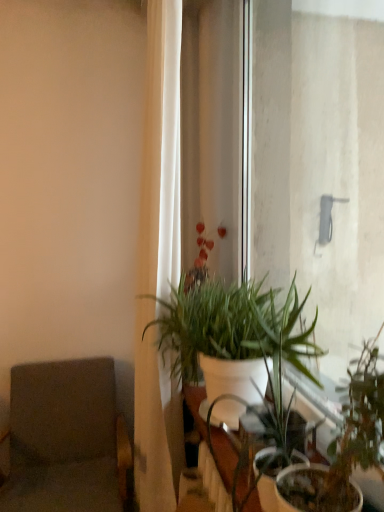
Question: From the image's perspective, is white glossy table at center on top of green matte plant at center, acting as the first houseplant starting from the front?

Choices:
 (A) yes
 (B) no

Answer: (A)

Question: Is white glossy table at center in contact with green matte plant at center, acting as the first houseplant starting from the front?

Choices:
 (A) no
 (B) yes

Answer: (A)

Question: From a real-world perspective, is white glossy table at center positioned over green matte plant at center, arranged as the second houseplant when viewed from the back, based on gravity?

Choices:
 (A) yes
 (B) no

Answer: (A)

Question: Would you say white glossy table at center contains green matte plant at center, acting as the first houseplant starting from the front?

Choices:
 (A) no
 (B) yes

Answer: (A)

Question: Considering the relative sizes of white glossy table at center and green matte plant at center, arranged as the second houseplant when viewed from the back, in the image provided, is white glossy table at center wider than green matte plant at center, arranged as the second houseplant when viewed from the back,?

Choices:
 (A) no
 (B) yes

Answer: (A)

Question: In the image, is green matte plant at center, arranged as the second houseplant when viewed from the back, on the left side or the right side of white matte plant at center, the first houseplant when ordered from back to front?

Choices:
 (A) right
 (B) left

Answer: (A)

Question: From a real-world perspective, is green matte plant at center, acting as the first houseplant starting from the front, positioned above or below white matte plant at center, the first houseplant when ordered from back to front?

Choices:
 (A) above
 (B) below

Answer: (B)

Question: Does point (342, 492) appear closer or farther from the camera than point (235, 332)?

Choices:
 (A) farther
 (B) closer

Answer: (B)

Question: Considering the positions of green matte plant at center, acting as the first houseplant starting from the front, and white matte plant at center, which is the second houseplant in front-to-back order, in the image, is green matte plant at center, acting as the first houseplant starting from the front, taller or shorter than white matte plant at center, which is the second houseplant in front-to-back order,?

Choices:
 (A) tall
 (B) short

Answer: (B)

Question: In the image, is white glossy table at center positioned in front of or behind white fabric curtain at left?

Choices:
 (A) front
 (B) behind

Answer: (A)

Question: From the image's perspective, is white glossy table at center above or below white fabric curtain at left?

Choices:
 (A) below
 (B) above

Answer: (A)

Question: Considering the positions of white glossy table at center and white fabric curtain at left in the image, is white glossy table at center bigger or smaller than white fabric curtain at left?

Choices:
 (A) small
 (B) big

Answer: (A)

Question: Is white glossy table at center wider or thinner than white fabric curtain at left?

Choices:
 (A) wide
 (B) thin

Answer: (A)

Question: Considering the positions of white matte plant at center, which is the second houseplant in front-to-back order, and gray fabric swivel chair at left in the image, is white matte plant at center, which is the second houseplant in front-to-back order, taller or shorter than gray fabric swivel chair at left?

Choices:
 (A) short
 (B) tall

Answer: (A)

Question: Considering the positions of point (175, 309) and point (109, 436), is point (175, 309) closer or farther from the camera than point (109, 436)?

Choices:
 (A) closer
 (B) farther

Answer: (A)